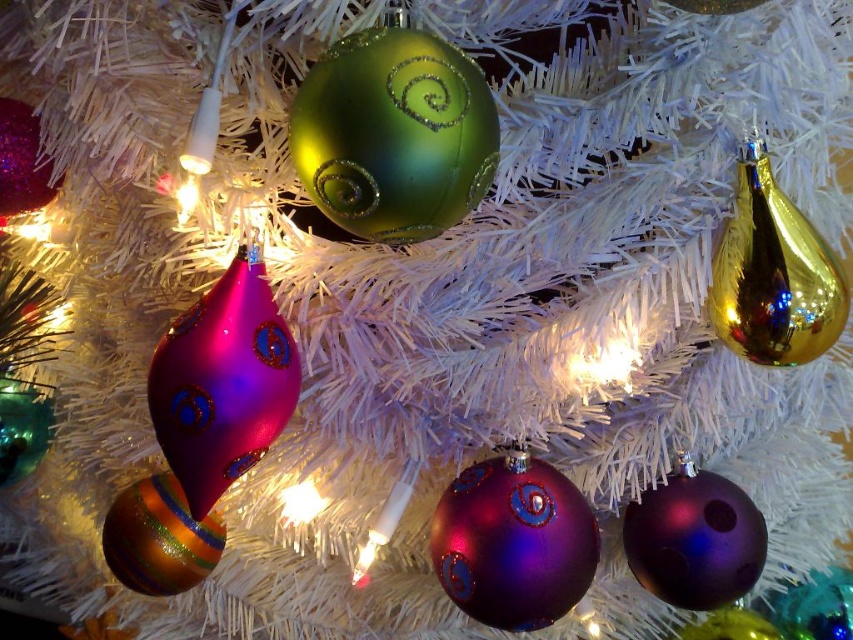
Question: Considering the relative positions of glossy glass ornament at center-left and matte purple ball at center in the image provided, where is glossy glass ornament at center-left located with respect to matte purple ball at center?

Choices:
 (A) above
 (B) below

Answer: (A)

Question: Which object appears closest to the camera in this image?

Choices:
 (A) green glossy ornament at upper center
 (B) matte purple ball at center
 (C) gold reflective teardrop at right

Answer: (A)

Question: Can you confirm if green glossy ornament at upper center is positioned below gold reflective teardrop at right?

Choices:
 (A) no
 (B) yes

Answer: (A)

Question: Among these points, which one is nearest to the camera?

Choices:
 (A) (537, 627)
 (B) (401, 198)

Answer: (B)

Question: Can you confirm if green glossy ornament at upper center is positioned below glossy glass ornament at center-left?

Choices:
 (A) no
 (B) yes

Answer: (A)

Question: Which of the following is the farthest from the observer?

Choices:
 (A) glossy glass ornament at center-left
 (B) green glossy ornament at upper center
 (C) gold reflective teardrop at right

Answer: (A)